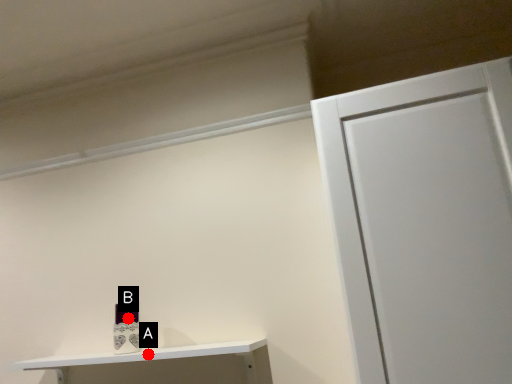
Question: Two points are circled on the image, labeled by A and B beside each circle. Which point appears farthest from the camera in this image?

Choices:
 (A) A is further
 (B) B is further

Answer: (B)